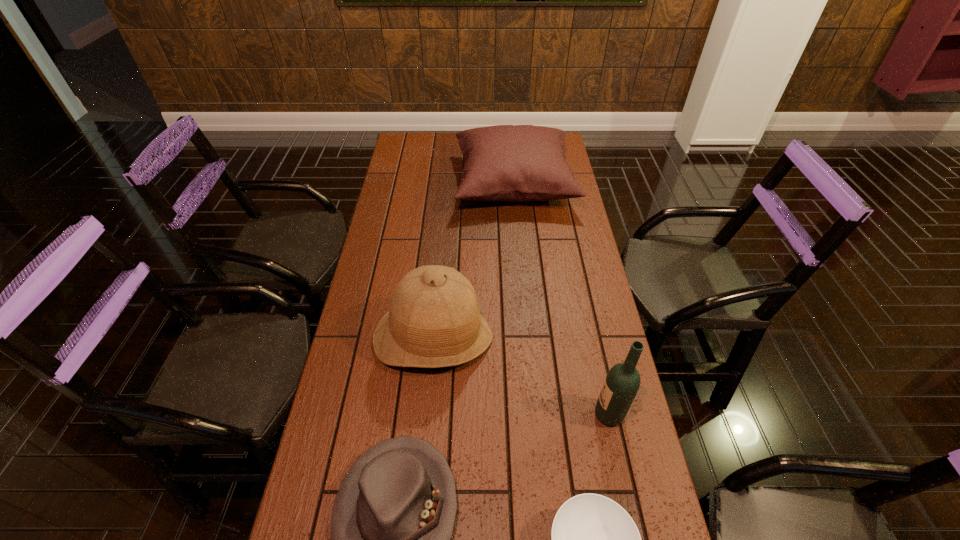
Where is `the third nearest object`? This screenshot has height=540, width=960. the third nearest object is located at coordinates (622, 382).

Locate an element on the screen. The image size is (960, 540). the farther hat is located at coordinates (434, 320).

The image size is (960, 540). Identify the location of the second farthest object. (434, 320).

Image resolution: width=960 pixels, height=540 pixels. I want to click on cushion, so click(517, 163).

Identify the location of the third shortest object. Image resolution: width=960 pixels, height=540 pixels. (517, 163).

Where is `free space located on the labeled side of the third nearest object`? The image size is (960, 540). free space located on the labeled side of the third nearest object is located at coordinates (449, 414).

Identify the location of vacant space positioned on the labeled side of the third nearest object. Image resolution: width=960 pixels, height=540 pixels. (x=465, y=414).

This screenshot has height=540, width=960. Find the location of `vacant area situated 0.060m on the labeled side of the third nearest object`. vacant area situated 0.060m on the labeled side of the third nearest object is located at coordinates (570, 414).

Locate an element on the screen. This screenshot has height=540, width=960. vacant space located on the front-facing side of the farther hat is located at coordinates (420, 478).

The height and width of the screenshot is (540, 960). What are the coordinates of `vacant point located on the front of the cushion` in the screenshot? It's located at (518, 238).